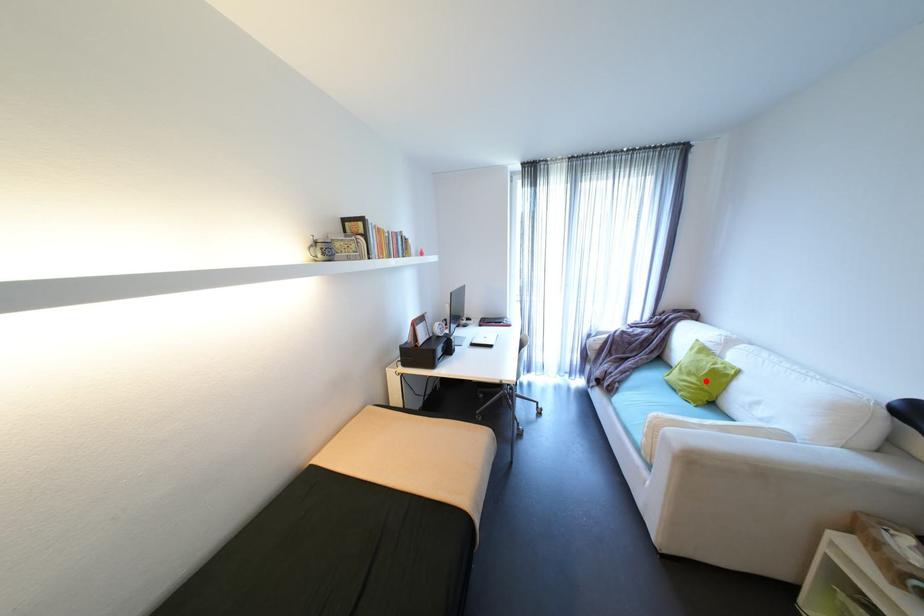
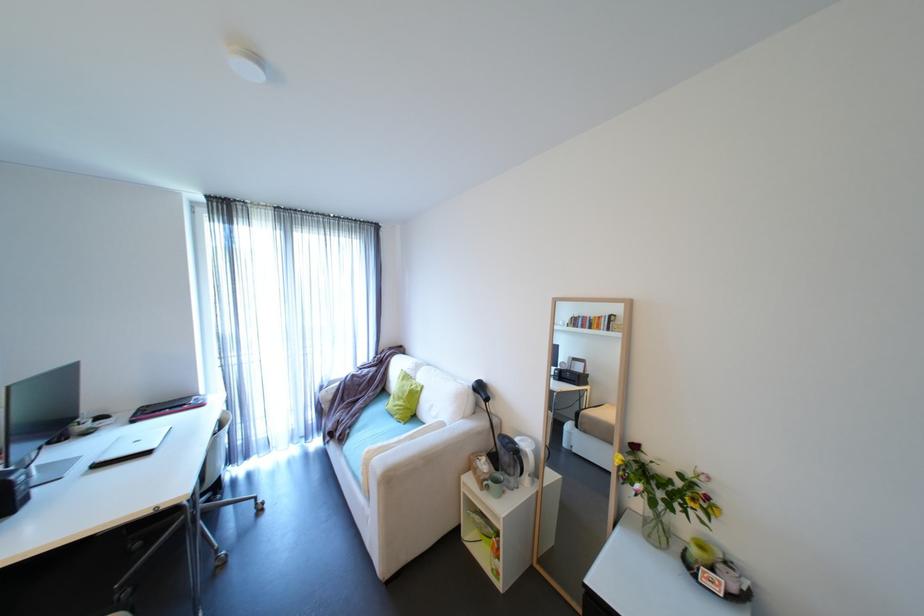
In the second image, find the point that corresponds to the highlighted location in the first image.

(411, 402)